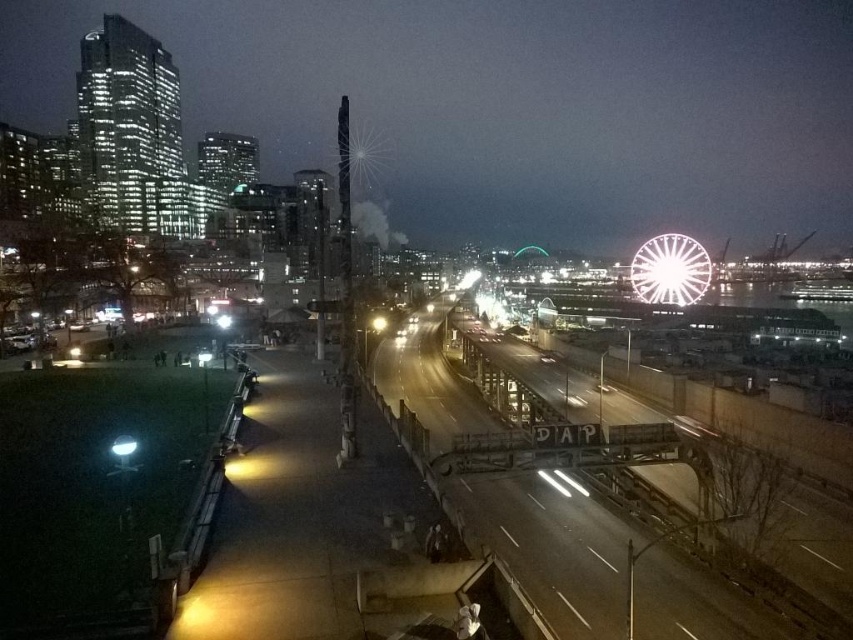
Consider the image. You are a city planner evaluating the urban layout. Given the metallic bridge at center and the bright white metallic ferris wheel at upper right, which structure has a greater width?

The metallic bridge at center has a greater width than the bright white metallic ferris wheel at upper right according to the description.

You are a tourist standing on the pedestrian walkway and want to take a photo of both the metallic bridge at center and the bright white metallic ferris wheel at upper right. Which object should you position closer to the left side of your camera frame?

The metallic bridge at center should be positioned closer to the left side of your camera frame because it is located to the left of the bright white metallic ferris wheel at upper right in the scene.